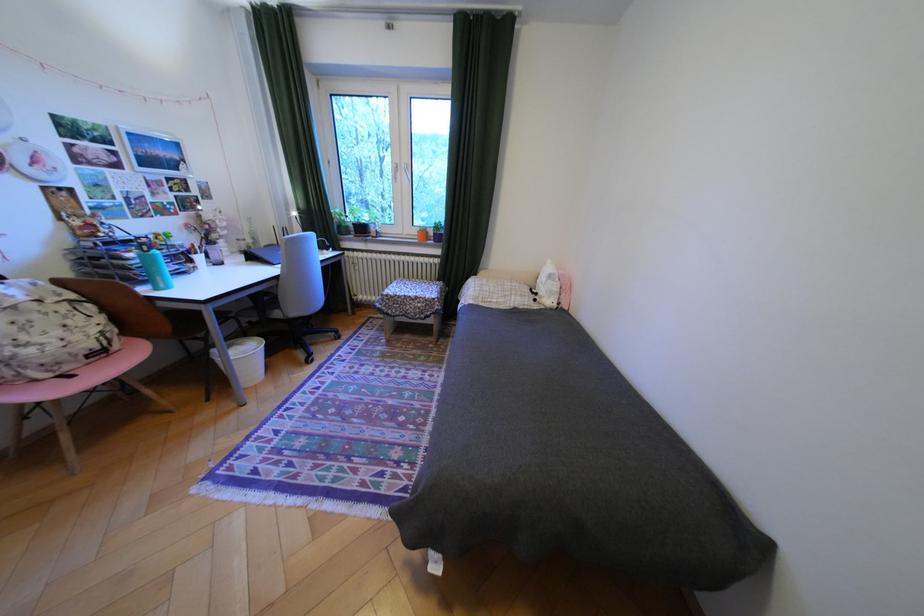
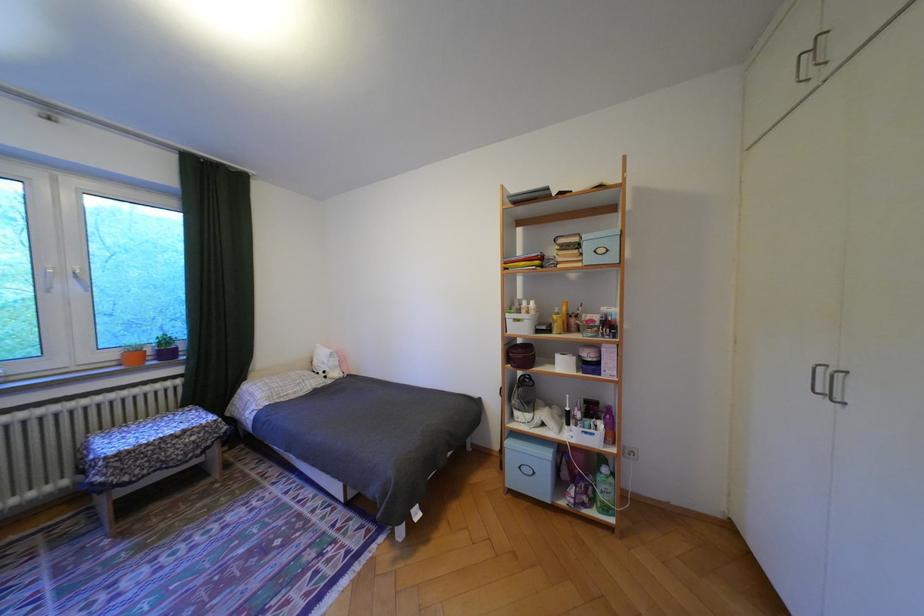
Where in the second image is the point corresponding to point (417, 174) from the first image?

(84, 280)